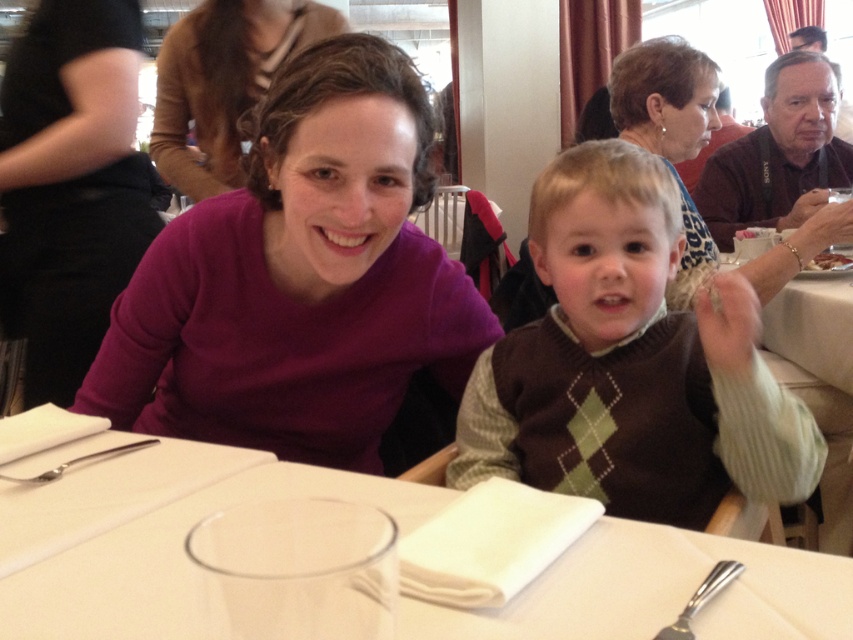
Measure the distance from matte purple sweater at center to purple sweater at upper left.

matte purple sweater at center and purple sweater at upper left are 38.36 inches apart.

Can you confirm if matte purple sweater at center is thinner than purple sweater at upper left?

Indeed, matte purple sweater at center has a lesser width compared to purple sweater at upper left.

I want to click on matte purple sweater at center, so coord(223,83).

Who is more distant from viewer, (583, 192) or (817, 256)?

The point (817, 256) is behind.

Image resolution: width=853 pixels, height=640 pixels. Find the location of `brown argyle sweater vest at center`. brown argyle sweater vest at center is located at coordinates (630, 364).

Between purple matte sweater at upper left and matte purple sweater at upper left, which one has more height?

matte purple sweater at upper left

Is purple matte sweater at upper left positioned at the back of matte purple sweater at upper left?

No, purple matte sweater at upper left is in front of matte purple sweater at upper left.

Is point (407, 284) positioned before point (57, 100)?

That is True.

This screenshot has height=640, width=853. Find the location of `purple matte sweater at upper left`. purple matte sweater at upper left is located at coordinates (299, 280).